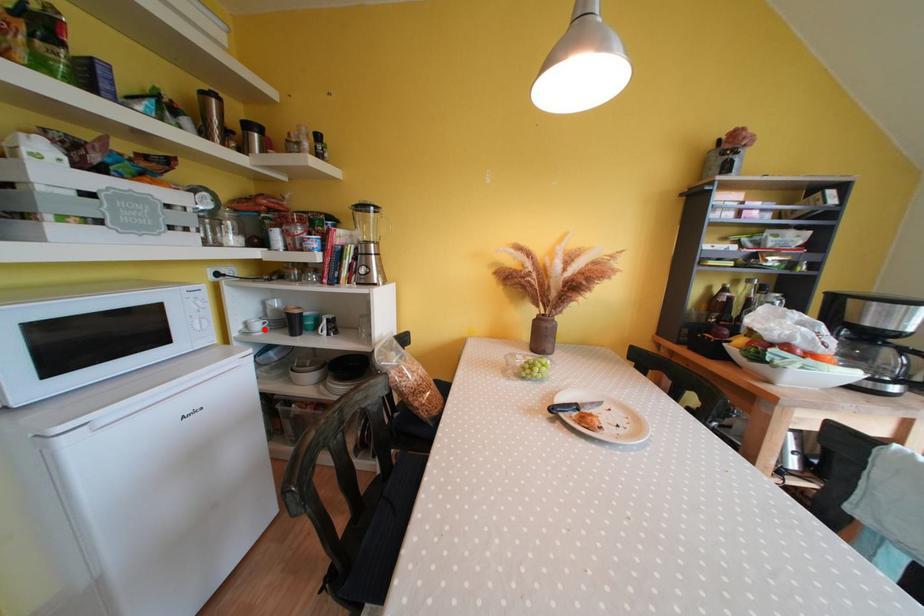
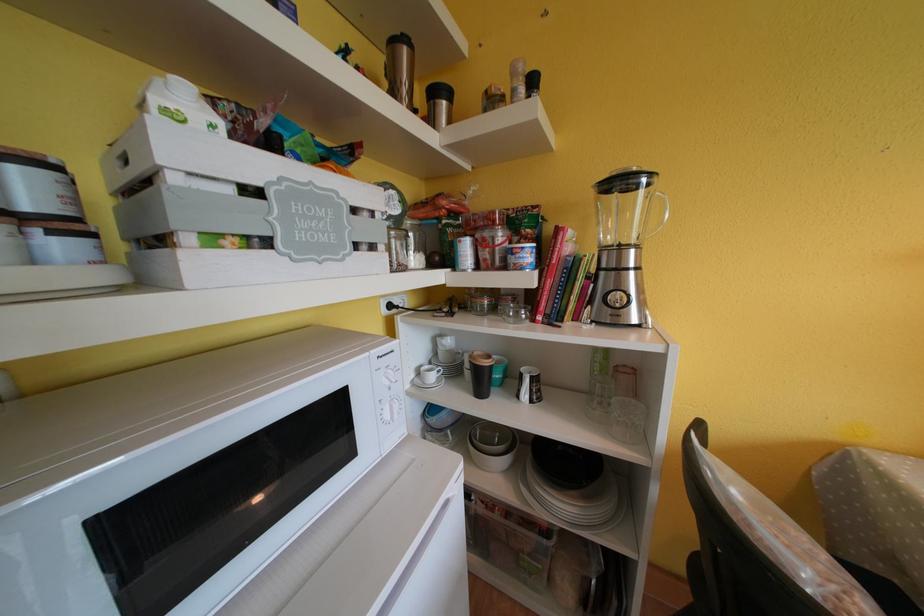
Locate, in the second image, the point that corresponds to the highlighted location in the first image.

(439, 381)